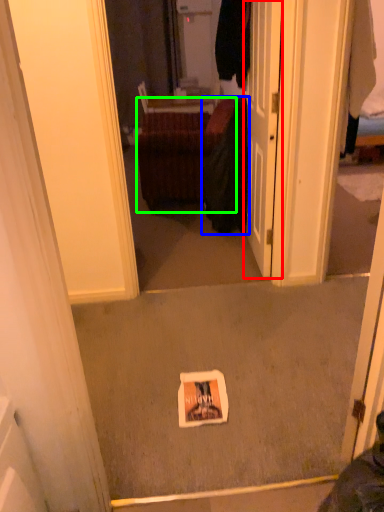
Question: Which object is the closest to the door (highlighted by a red box)? Choose among these: clothing (highlighted by a blue box) or furniture (highlighted by a green box).

Choices:
 (A) clothing
 (B) furniture

Answer: (A)